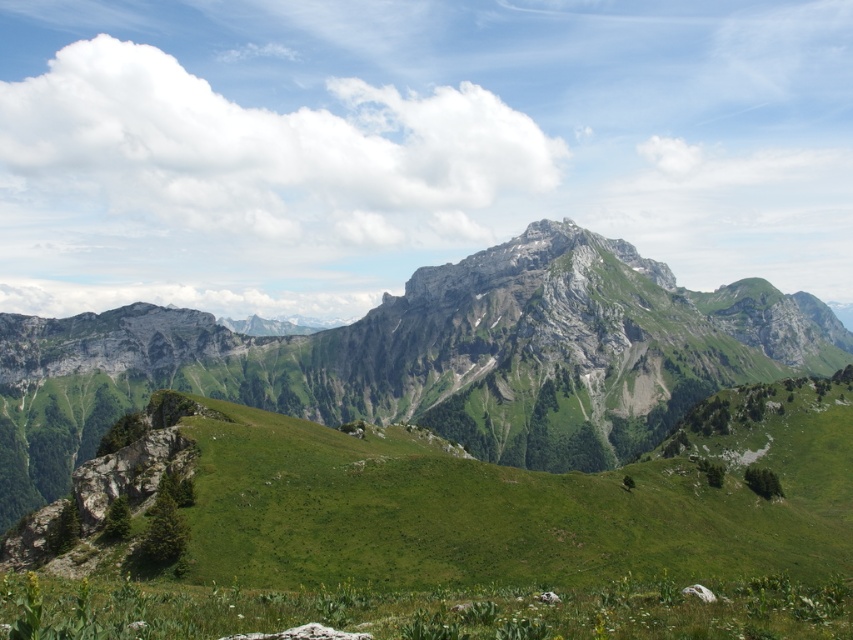
Question: Among these points, which one is farthest from the camera?

Choices:
 (A) (144, 584)
 (B) (318, 352)

Answer: (B)

Question: Which point is farther to the camera?

Choices:
 (A) green grassy at lower left
 (B) green grassy mountain at center

Answer: (B)

Question: Can you confirm if green grassy mountain at center is positioned above green grassy at lower left?

Choices:
 (A) no
 (B) yes

Answer: (B)

Question: Where is green grassy mountain at center located in relation to green grassy at lower left in the image?

Choices:
 (A) below
 (B) above

Answer: (B)

Question: Where is green grassy mountain at center located in relation to green grassy at lower left in the image?

Choices:
 (A) left
 (B) right

Answer: (B)